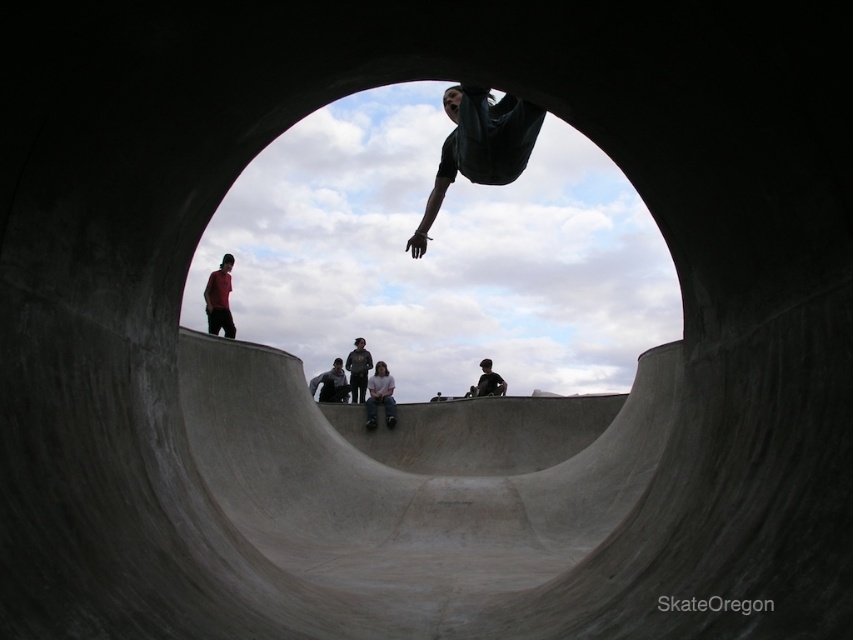
Question: Observing the image, what is the correct spatial positioning of light gray jeans at center in reference to dark gray concrete skateboarder at center?

Choices:
 (A) left
 (B) right

Answer: (A)

Question: Is dark green fabric at center smaller than dark gray concrete skateboarder at center?

Choices:
 (A) no
 (B) yes

Answer: (A)

Question: Among these objects, which one is nearest to the camera?

Choices:
 (A) dark gray hoodie at center
 (B) dark green fabric at center

Answer: (B)

Question: Estimate the real-world distances between objects in this image. Which object is closer to the light gray jeans at center?

Choices:
 (A) dark green fabric at center
 (B) dark gray hoodie at center
 (C) dark gray concrete skateboarder at center
 (D) black rubber skateboard at center

Answer: (D)

Question: Is red shirt at upper left to the left of dark gray hoodie at center from the viewer's perspective?

Choices:
 (A) no
 (B) yes

Answer: (B)

Question: Which point is farther from the camera taking this photo?

Choices:
 (A) (374, 400)
 (B) (375, 419)
 (C) (231, 337)
 (D) (480, 387)

Answer: (D)